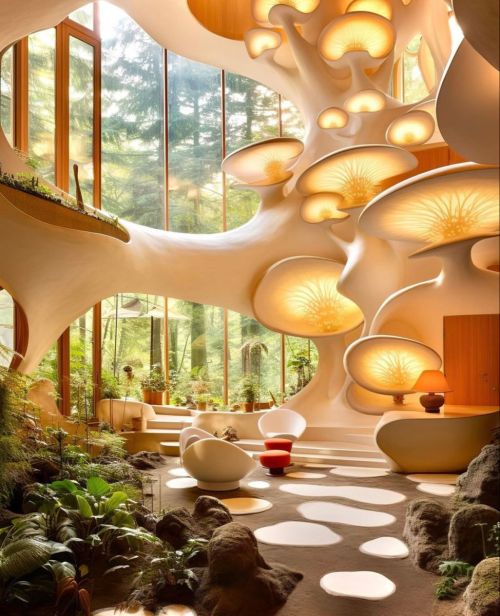
You are a GUI agent. You are given a task and a screenshot of the screen. Output one action in this format:
    pyautogui.click(x=<x>, y=<y>)
    Task: Click on the door
    This screenshot has height=616, width=500.
    Given the screenshot: What is the action you would take?
    pyautogui.click(x=480, y=337)